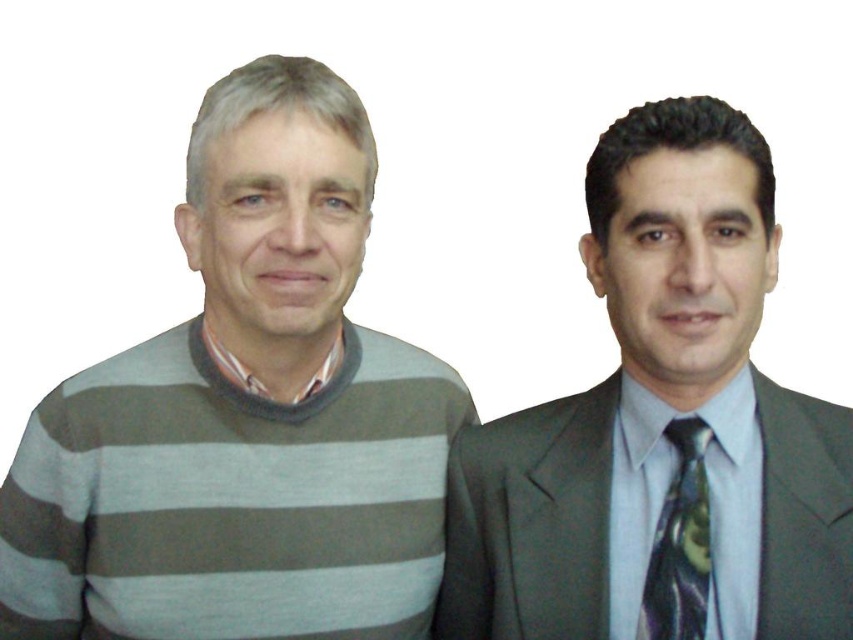
You are a photographer adjusting the camera settings to ensure both the gray striped sweater at left and the shiny dark green tie at right are in focus. Given that the depth of field can only accommodate one of the objects at a time, which object should you prioritize focusing on to ensure it appears sharp?

The gray striped sweater at left has a greater height compared to the shiny dark green tie at right, so you should prioritize focusing on the gray striped sweater at left to ensure it appears sharp.

In the scene shown: You are a photographer preparing to take a portrait of the two people in the image. You need to ensure that the matte gray suit at right and the shiny dark green tie at right are both clearly visible in the photo. Given their size difference, which item might require closer attention to ensure proper focus?

The shiny dark green tie at right is smaller than the matte gray suit at right, so it might require closer attention to ensure proper focus due to its smaller size.

You are a photographer setting up a shoot with two people. The scene requires that the person wearing the gray striped sweater at left must be positioned lower than the person wearing the shiny dark green tie at right. Based on the current arrangement shown in the image, is this requirement already met?

The gray striped sweater at left is located above the shiny dark green tie at right in the image, so the requirement for the sweater to be positioned lower than the tie is not currently met.